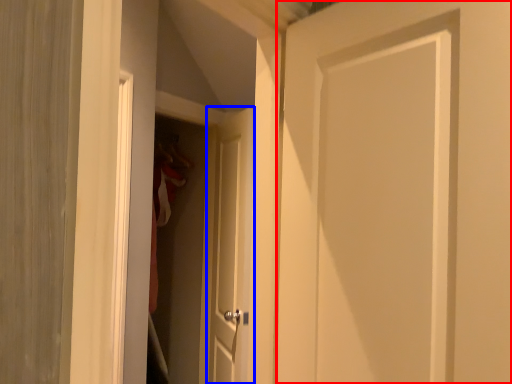
Question: Which object is further to the camera taking this photo, door (highlighted by a red box) or door (highlighted by a blue box)?

Choices:
 (A) door
 (B) door

Answer: (B)